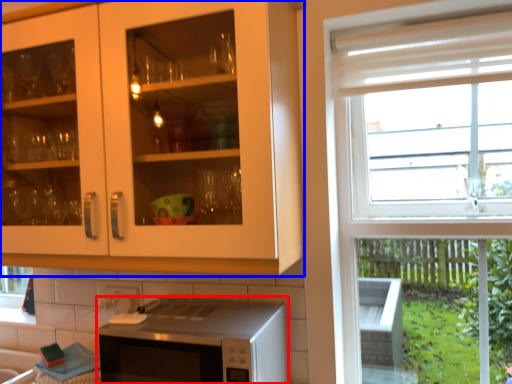
Question: Which point is further to the camera, microwave oven (highlighted by a red box) or cabinetry (highlighted by a blue box)?

Choices:
 (A) microwave oven
 (B) cabinetry

Answer: (A)